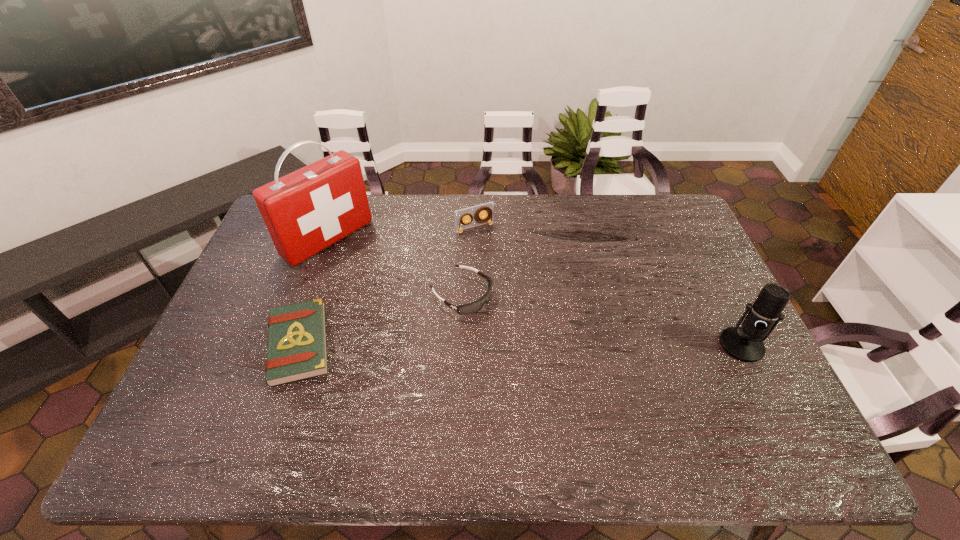
In the image, there is a desktop. Where is `vacant space at the near right corner`? This screenshot has height=540, width=960. vacant space at the near right corner is located at coordinates (770, 407).

Locate an element on the screen. free point between the first-aid kit and the second tallest object is located at coordinates (535, 292).

Locate an element on the screen. Image resolution: width=960 pixels, height=540 pixels. vacant region between the first-aid kit and the rightmost object is located at coordinates (535, 292).

The height and width of the screenshot is (540, 960). In order to click on free spot between the third shortest object and the first-aid kit in this screenshot , I will do `click(401, 233)`.

Where is `empty space that is in between the shortest object and the videotape`? This screenshot has height=540, width=960. empty space that is in between the shortest object and the videotape is located at coordinates (387, 286).

This screenshot has width=960, height=540. In order to click on free point between the second shortest object and the shortest object in this screenshot , I will do `click(380, 319)`.

The image size is (960, 540). I want to click on free point between the videotape and the book, so click(387, 286).

This screenshot has width=960, height=540. What are the coordinates of `free area in between the shortest object and the tallest object` in the screenshot? It's located at (314, 292).

I want to click on free space between the third shortest object and the first-aid kit, so click(401, 233).

At what (x,y) coordinates should I click in order to perform the action: click on blank region between the microphone and the goggles. Please return your answer as a coordinate pair (x, y). This screenshot has height=540, width=960. Looking at the image, I should click on point(602,320).